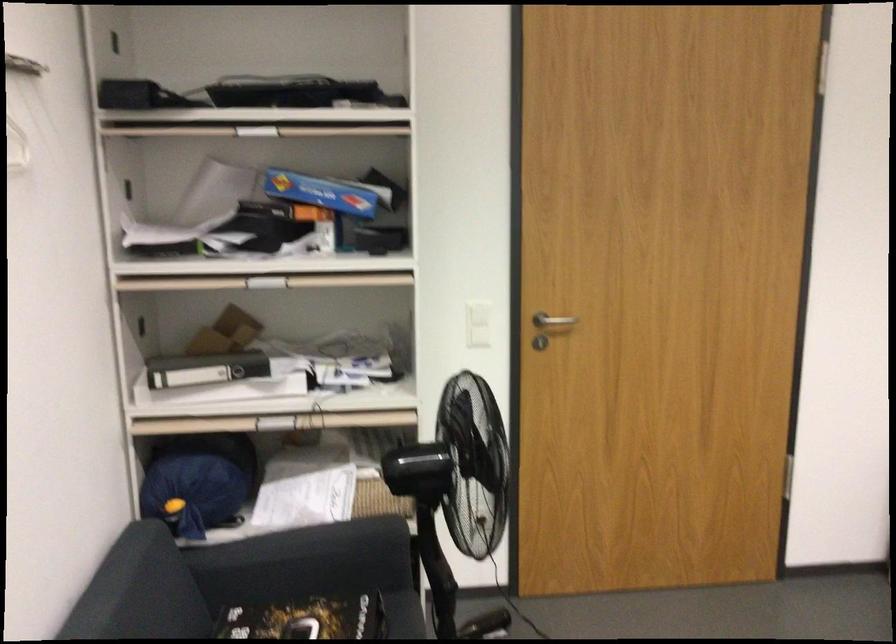
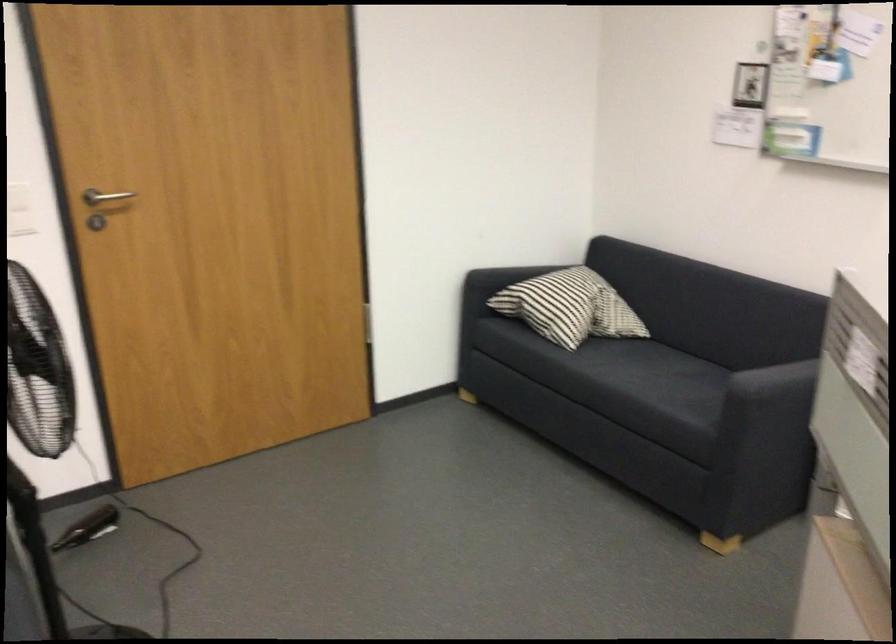
Find the pixel in the second image that matches the point at 562,317 in the first image.

(105, 196)